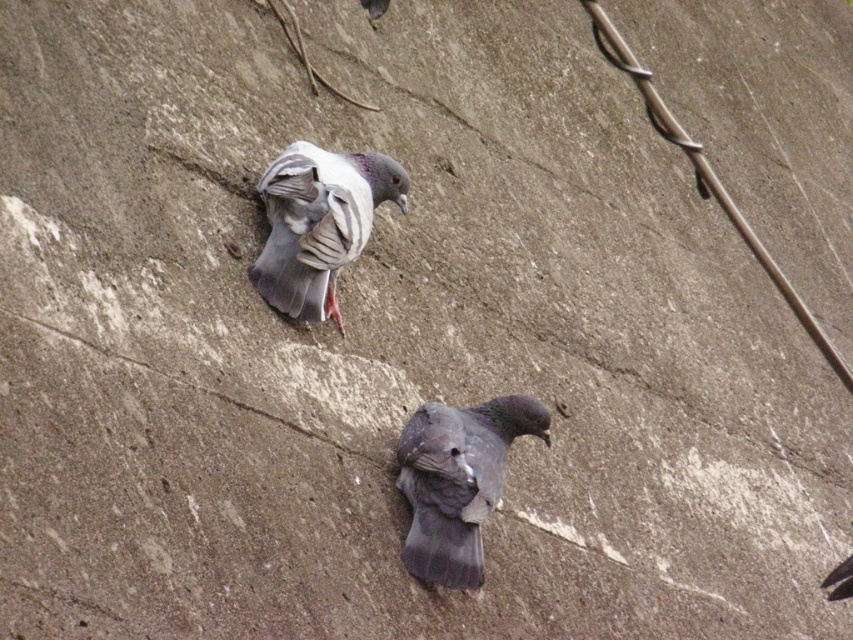
Between point (421, 412) and point (264, 243), which one is positioned behind?

The point (264, 243) is more distant.

Between gray matte pigeon at center and gray matte pigeon at upper center, which one is positioned higher?

gray matte pigeon at upper center is above.

Describe the element at coordinates (457, 481) in the screenshot. I see `gray matte pigeon at center` at that location.

The image size is (853, 640). Find the location of `gray matte pigeon at center`. gray matte pigeon at center is located at coordinates (457, 481).